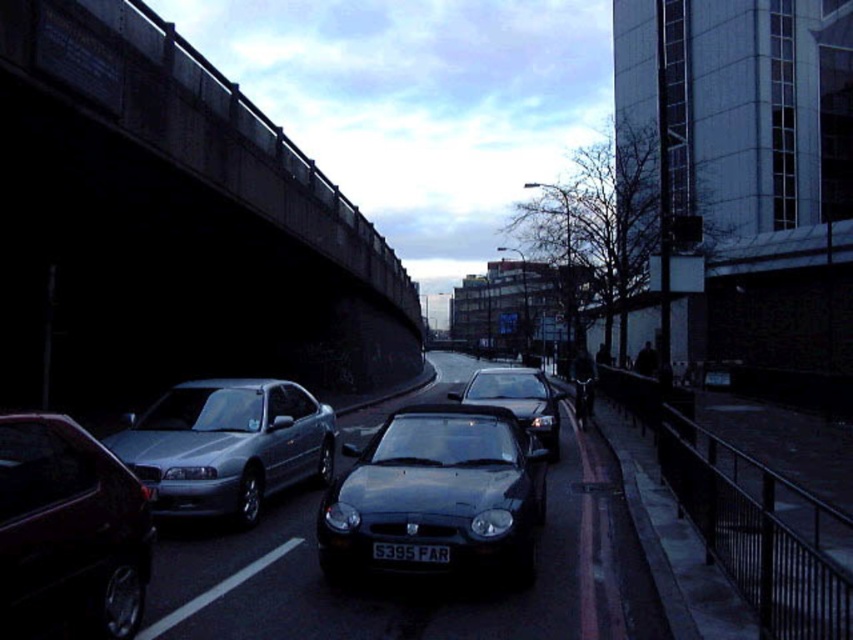
You are a delivery driver who needs to park your truck on the street. You see the shiny metallic car at left and the satin silver sedan at center. Which vehicle is blocking the parking spot you want to take?

The shiny metallic car at left is positioned over the satin silver sedan at center, meaning it is blocking the parking spot where the satin silver sedan at center is parked.

You are a photographer trying to capture the entire scene of the concrete bridge at upper left and the shiny metallic car at left in one frame. Given that your camera can only focus on objects within a 100cm width, will you be able to include both in your shot?

The concrete bridge at upper left is bigger than the shiny metallic car at left, so it might occupy more space in the frame. However, without specific width measurements, it is uncertain if both can fit within the 100cm width constraint.